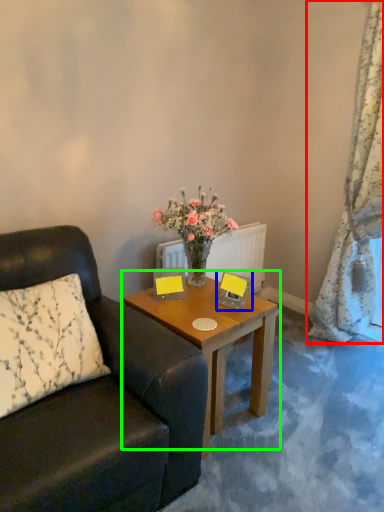
Question: Which object is positioned farthest from curtain (highlighted by a red box)? Select from picture frame (highlighted by a blue box) and coffee table (highlighted by a green box).

Choices:
 (A) picture frame
 (B) coffee table

Answer: (A)